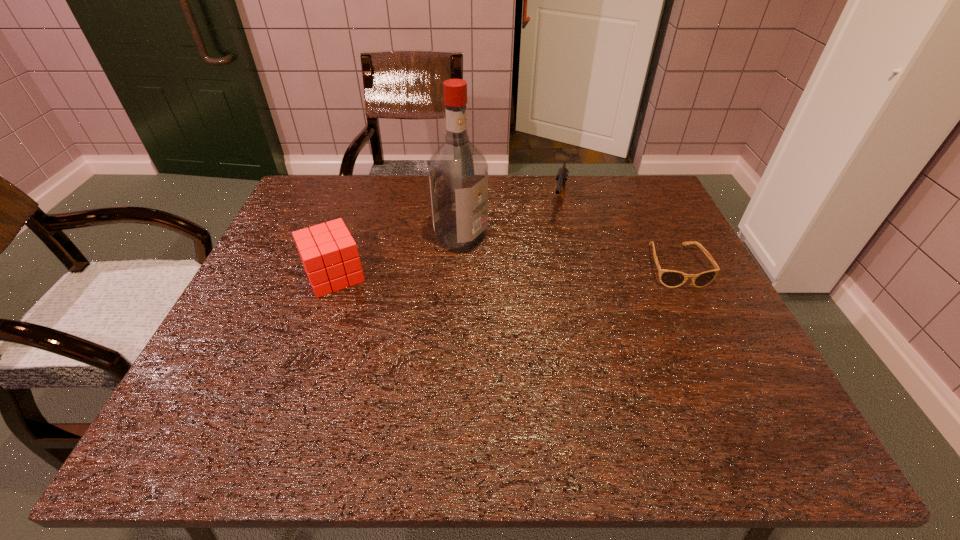
This screenshot has height=540, width=960. What are the coordinates of `vacant point located between the tallest object and the shortest object` in the screenshot? It's located at (567, 252).

The image size is (960, 540). In order to click on object that is the third nearest to the leftmost object in this screenshot , I will do `click(670, 278)`.

Image resolution: width=960 pixels, height=540 pixels. Find the location of `the closest object to the shortest object`. the closest object to the shortest object is located at coordinates (562, 174).

What are the coordinates of `vacant space that satisfies the following two spatial constraints: 1. on the back side of the gun; 2. on the left side of the cube` in the screenshot? It's located at (359, 207).

Locate an element on the screen. The width and height of the screenshot is (960, 540). free space that satisfies the following two spatial constraints: 1. on the back side of the gun; 2. on the right side of the tallest object is located at coordinates (463, 207).